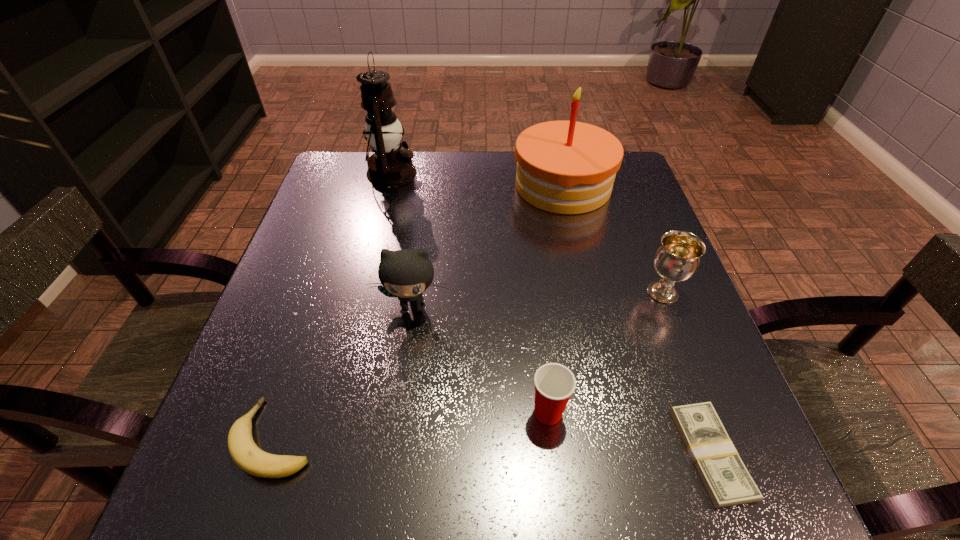
At what (x,y) coordinates should I click in order to perform the action: click on the tallest object. Please return your answer as a coordinate pair (x, y). Looking at the image, I should click on (389, 166).

This screenshot has width=960, height=540. Find the location of `the second tallest object`. the second tallest object is located at coordinates (566, 167).

Identify the location of kitten. (406, 274).

Locate an element on the screen. chalice is located at coordinates (677, 259).

This screenshot has width=960, height=540. Identify the location of Dixie cup. (554, 383).

Locate an element on the screen. The height and width of the screenshot is (540, 960). the second shortest object is located at coordinates (245, 453).

The image size is (960, 540). I want to click on dollar, so click(x=725, y=477).

Locate an element on the screen. free spot located 0.370m on the side of the lantern, there is a wick adjustment knob is located at coordinates (554, 173).

Locate an element on the screen. This screenshot has width=960, height=540. vacant region located on the left of the birthday cake is located at coordinates point(475,186).

Where is `free spot located on the front-facing side of the kitten`? This screenshot has width=960, height=540. free spot located on the front-facing side of the kitten is located at coordinates (x=387, y=490).